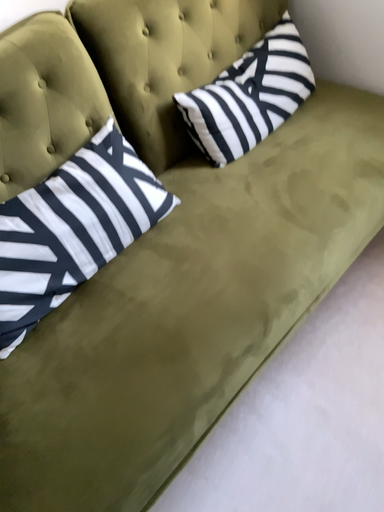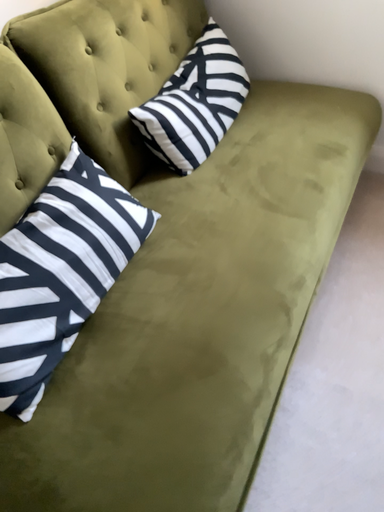
Question: How did the camera likely rotate when shooting the video?

Choices:
 (A) rotated left
 (B) rotated right

Answer: (B)